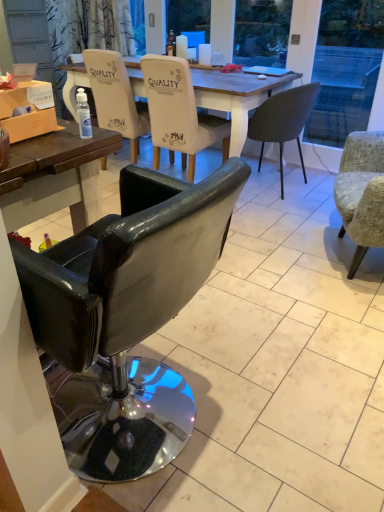
Describe the element at coordinates (178, 113) in the screenshot. I see `white fabric chair at center, arranged as the third chair when viewed from the front` at that location.

Identify the location of matte white coffee cup at upper center, placed as the 2th coffee cup when sorted from left to right. (205, 54).

Where is `matte white chair at center, placed as the 5th chair when sorted from front to back`? matte white chair at center, placed as the 5th chair when sorted from front to back is located at coordinates (115, 97).

Identify the location of textured gray armchair at right, marked as the fourth chair in a back-to-front arrangement. The width and height of the screenshot is (384, 512). (361, 193).

Where is `white fabric chair at center, arranged as the third chair when viewed from the back`? white fabric chair at center, arranged as the third chair when viewed from the back is located at coordinates 178,113.

Which object is wider, matte white chair at center, placed as the 5th chair when sorted from front to back, or transparent plastic spray bottle at center?

matte white chair at center, placed as the 5th chair when sorted from front to back, is wider.

Which is behind, point (123, 79) or point (79, 131)?

Point (123, 79)

Does matte white chair at center, placed as the 5th chair when sorted from front to back, have a greater height compared to transparent plastic spray bottle at center?

Indeed, matte white chair at center, placed as the 5th chair when sorted from front to back, has a greater height compared to transparent plastic spray bottle at center.

Is matte white chair at center, placed as the 5th chair when sorted from front to back, with transparent plastic spray bottle at center?

matte white chair at center, placed as the 5th chair when sorted from front to back, is not next to transparent plastic spray bottle at center, and they're not touching.

Considering the sizes of matte white coffee cup at upper center, which is the 1th coffee cup from right to left, and black leather chair at lower left, acting as the 1th chair starting from the front, in the image, is matte white coffee cup at upper center, which is the 1th coffee cup from right to left, bigger or smaller than black leather chair at lower left, acting as the 1th chair starting from the front,?

In the image, matte white coffee cup at upper center, which is the 1th coffee cup from right to left, appears to be smaller than black leather chair at lower left, acting as the 1th chair starting from the front.

Is matte white coffee cup at upper center, which is the 1th coffee cup from right to left, shorter than black leather chair at lower left, the fifth chair when ordered from back to front?

Indeed, matte white coffee cup at upper center, which is the 1th coffee cup from right to left, has a lesser height compared to black leather chair at lower left, the fifth chair when ordered from back to front.

Which of these two, matte white coffee cup at upper center, which is the 1th coffee cup from right to left, or black leather chair at lower left, acting as the 1th chair starting from the front, is thinner?

Thinner between the two is matte white coffee cup at upper center, which is the 1th coffee cup from right to left.

Which object is more forward, matte white coffee cup at upper center, marked as the third coffee cup in a left-to-right arrangement, or black leather chair at lower left, acting as the 1th chair starting from the front?

black leather chair at lower left, acting as the 1th chair starting from the front.

From a real-world perspective, does matte dark gray chair at center, acting as the fourth chair starting from the front, stand above metallic silver laptop at center?

No, from a real-world perspective, matte dark gray chair at center, acting as the fourth chair starting from the front, is not on top of metallic silver laptop at center.

Which is closer to the camera, (275, 127) or (274, 75)?

The point (275, 127) is closer to the camera.

From the image's perspective, would you say matte dark gray chair at center, which appears as the 2th chair when viewed from the back, is shown under metallic silver laptop at center?

Yes, from the image's perspective, matte dark gray chair at center, which appears as the 2th chair when viewed from the back, is below metallic silver laptop at center.

From the picture: Considering the sizes of matte white coffee cup at upper center, placed as the 2th coffee cup when sorted from left to right, and transparent plastic spray bottle at center in the image, is matte white coffee cup at upper center, placed as the 2th coffee cup when sorted from left to right, bigger or smaller than transparent plastic spray bottle at center?

matte white coffee cup at upper center, placed as the 2th coffee cup when sorted from left to right, is bigger than transparent plastic spray bottle at center.

Considering the positions of objects matte white coffee cup at upper center, which appears as the second coffee cup when viewed from the right, and transparent plastic spray bottle at center in the image provided, who is more to the right, matte white coffee cup at upper center, which appears as the second coffee cup when viewed from the right, or transparent plastic spray bottle at center?

From the viewer's perspective, matte white coffee cup at upper center, which appears as the second coffee cup when viewed from the right, appears more on the right side.

Could you tell me if matte white coffee cup at upper center, which appears as the second coffee cup when viewed from the right, is turned towards transparent plastic spray bottle at center?

No, matte white coffee cup at upper center, which appears as the second coffee cup when viewed from the right, is not oriented towards transparent plastic spray bottle at center.

Considering the relative sizes of matte white coffee cup at upper center, which appears as the second coffee cup when viewed from the right, and transparent plastic spray bottle at center in the image provided, is matte white coffee cup at upper center, which appears as the second coffee cup when viewed from the right, taller than transparent plastic spray bottle at center?

Yes, matte white coffee cup at upper center, which appears as the second coffee cup when viewed from the right, is taller than transparent plastic spray bottle at center.

Is metallic silver laptop at center looking in the opposite direction of matte white coffee cup at upper center, which is the 3th coffee cup from right to left?

No, metallic silver laptop at center is not facing away from matte white coffee cup at upper center, which is the 3th coffee cup from right to left.

Does metallic silver laptop at center lie in front of matte white coffee cup at upper center, which is the 3th coffee cup from right to left?

Yes, metallic silver laptop at center is closer to the camera.

Between metallic silver laptop at center and matte white coffee cup at upper center, which is the 3th coffee cup from right to left, which one has more height?

matte white coffee cup at upper center, which is the 3th coffee cup from right to left, is taller.

Considering the points (271, 72) and (184, 49), which point is in front, point (271, 72) or point (184, 49)?

Point (271, 72)

Can you confirm if matte white coffee cup at upper center, which appears as the second coffee cup when viewed from the right, is positioned to the right of matte white coffee cup at upper center, which is the 1th coffee cup from right to left?

In fact, matte white coffee cup at upper center, which appears as the second coffee cup when viewed from the right, is to the left of matte white coffee cup at upper center, which is the 1th coffee cup from right to left.

Would you say matte white coffee cup at upper center, which appears as the second coffee cup when viewed from the right, contains matte white coffee cup at upper center, marked as the third coffee cup in a left-to-right arrangement?

No.

Can you tell me how much matte white coffee cup at upper center, which appears as the second coffee cup when viewed from the right, and matte white coffee cup at upper center, marked as the third coffee cup in a left-to-right arrangement, differ in facing direction?

The facing directions of matte white coffee cup at upper center, which appears as the second coffee cup when viewed from the right, and matte white coffee cup at upper center, marked as the third coffee cup in a left-to-right arrangement, are 1.9 degrees apart.

Is matte white coffee cup at upper center, which appears as the second coffee cup when viewed from the right, oriented away from matte white coffee cup at upper center, marked as the third coffee cup in a left-to-right arrangement?

No.

Based on the photo, does wooden box at left have a larger size compared to matte white coffee cup at upper center, the first coffee cup positioned from the left?

Yes, wooden box at left is bigger than matte white coffee cup at upper center, the first coffee cup positioned from the left.

Is matte white coffee cup at upper center, the first coffee cup positioned from the left, inside wooden box at left?

No.

Are wooden box at left and matte white coffee cup at upper center, which is the 3th coffee cup from right to left, making contact?

No, wooden box at left is not beside matte white coffee cup at upper center, which is the 3th coffee cup from right to left.

Which chair is the 4th one when counting from the back of the transparent plastic spray bottle at center? Please provide its 2D coordinates.

[(115, 97)]

Find the location of a particular element. The height and width of the screenshot is (512, 384). chair that is the 5th object located in front of the matte white coffee cup at upper center, marked as the third coffee cup in a left-to-right arrangement is located at coordinates (126, 316).

Considering their positions, is matte white coffee cup at upper center, which appears as the second coffee cup when viewed from the right, positioned closer to matte white coffee cup at upper center, which is the 1th coffee cup from right to left, than matte dark gray chair at center, acting as the fourth chair starting from the front?

Among the two, matte white coffee cup at upper center, which appears as the second coffee cup when viewed from the right, is located nearer to matte white coffee cup at upper center, which is the 1th coffee cup from right to left.

Based on their spatial positions, is metallic silver laptop at center or white fabric chair at center, arranged as the third chair when viewed from the back, further from matte white coffee cup at upper center, placed as the 2th coffee cup when sorted from left to right?

The object further to matte white coffee cup at upper center, placed as the 2th coffee cup when sorted from left to right, is white fabric chair at center, arranged as the third chair when viewed from the back.

Estimate the real-world distances between objects in this image. Which object is closer to wooden box at left, matte white coffee cup at upper center, marked as the third coffee cup in a left-to-right arrangement, or matte white coffee cup at upper center, which appears as the second coffee cup when viewed from the right?

Among the two, matte white coffee cup at upper center, which appears as the second coffee cup when viewed from the right, is located nearer to wooden box at left.

Based on their spatial positions, is matte dark gray chair at center, which appears as the 2th chair when viewed from the back, or matte white coffee cup at upper center, placed as the 2th coffee cup when sorted from left to right, further from matte white coffee cup at upper center, the first coffee cup positioned from the left?

Based on the image, matte dark gray chair at center, which appears as the 2th chair when viewed from the back, appears to be further to matte white coffee cup at upper center, the first coffee cup positioned from the left.

Based on the photo, which object lies further to the anchor point matte white chair at center, placed as the 5th chair when sorted from front to back, wooden box at left or matte white coffee cup at upper center, placed as the 2th coffee cup when sorted from left to right?

wooden box at left is positioned further to the anchor matte white chair at center, placed as the 5th chair when sorted from front to back.

When comparing their distances from white fabric chair at center, arranged as the third chair when viewed from the front, does metallic silver laptop at center or black leather chair at lower left, acting as the 1th chair starting from the front, seem closer?

Among the two, metallic silver laptop at center is located nearer to white fabric chair at center, arranged as the third chair when viewed from the front.

Considering their positions, is black leather chair at lower left, the fifth chair when ordered from back to front, positioned further to matte dark gray chair at center, acting as the fourth chair starting from the front, than matte white coffee cup at upper center, placed as the 2th coffee cup when sorted from left to right?

black leather chair at lower left, the fifth chair when ordered from back to front, is positioned further to the anchor matte dark gray chair at center, acting as the fourth chair starting from the front.

Looking at the image, which one is located further to matte white coffee cup at upper center, which is the 3th coffee cup from right to left, matte white coffee cup at upper center, which is the 1th coffee cup from right to left, or matte dark gray chair at center, which appears as the 2th chair when viewed from the back?

matte dark gray chair at center, which appears as the 2th chair when viewed from the back, lies further to matte white coffee cup at upper center, which is the 3th coffee cup from right to left, than the other object.

Image resolution: width=384 pixels, height=512 pixels. Identify the location of laptop located between black leather chair at lower left, acting as the 1th chair starting from the front, and matte white coffee cup at upper center, placed as the 2th coffee cup when sorted from left to right, in the depth direction. (266, 71).

The image size is (384, 512). Find the location of `laptop positioned between textured gray armchair at right, marked as the fourth chair in a back-to-front arrangement, and matte white coffee cup at upper center, marked as the third coffee cup in a left-to-right arrangement, from near to far`. laptop positioned between textured gray armchair at right, marked as the fourth chair in a back-to-front arrangement, and matte white coffee cup at upper center, marked as the third coffee cup in a left-to-right arrangement, from near to far is located at coordinates (266, 71).

Locate an element on the screen. Image resolution: width=384 pixels, height=512 pixels. bottle located between wooden box at left and matte dark gray chair at center, which appears as the 2th chair when viewed from the back, in the depth direction is located at coordinates (83, 114).

Locate an element on the screen. This screenshot has width=384, height=512. laptop located between black leather chair at lower left, acting as the 1th chair starting from the front, and matte white coffee cup at upper center, the first coffee cup positioned from the left, in the depth direction is located at coordinates (266, 71).